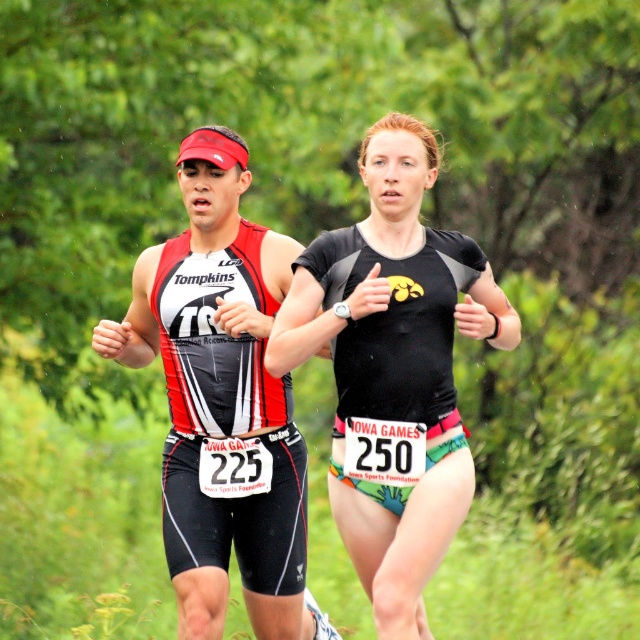
Does black matte running suit at center appear under matte triathlon suit at center?

No, black matte running suit at center is not below matte triathlon suit at center.

Which of these two, black matte running suit at center or matte triathlon suit at center, stands shorter?

black matte running suit at center

Image resolution: width=640 pixels, height=640 pixels. Describe the element at coordinates (394, 364) in the screenshot. I see `black matte running suit at center` at that location.

Find the location of `black matte running suit at center`. black matte running suit at center is located at coordinates (394, 364).